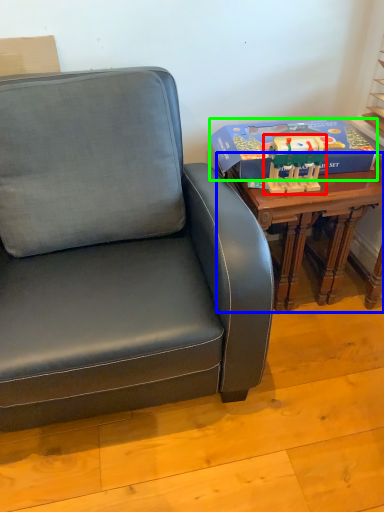
Question: Considering the real-world distances, which object is farthest from toy (highlighted by a red box)? table (highlighted by a blue box) or box (highlighted by a green box)?

Choices:
 (A) table
 (B) box

Answer: (A)